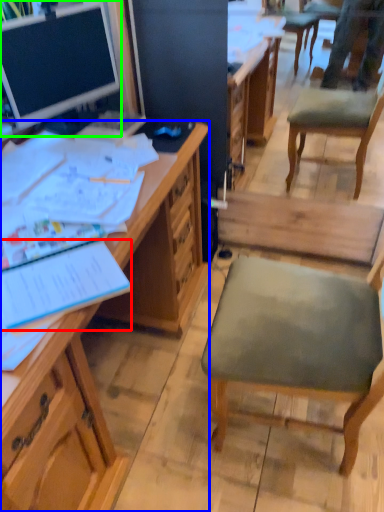
Question: Based on their relative distances, which object is farther from notebook (highlighted by a red box)? Choose from desk (highlighted by a blue box) and desk (highlighted by a green box).

Choices:
 (A) desk
 (B) desk

Answer: (B)